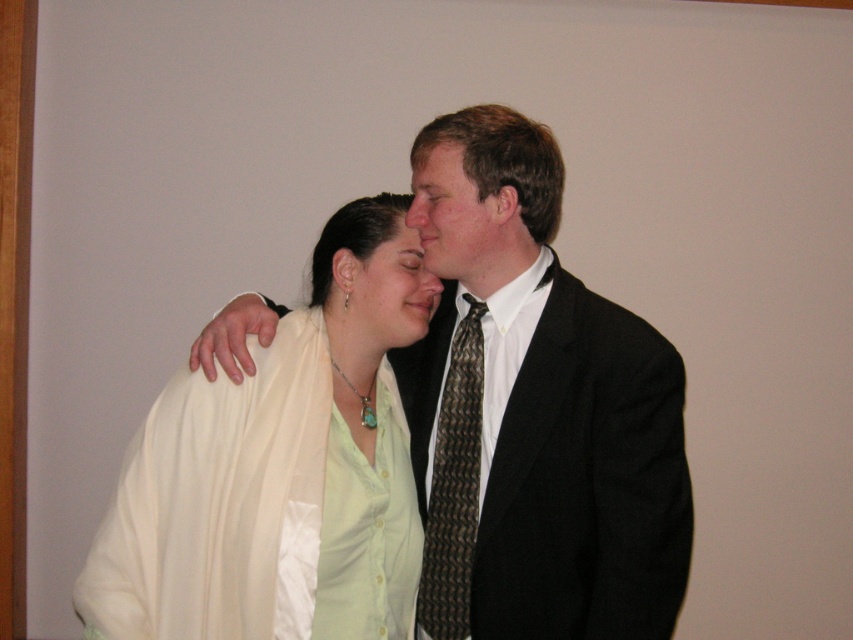
You are a photographer setting up for a portrait. You have a camera with a focal length of 50mm and want to capture both the light beige fabric at center and the matte black hair at center in sharp focus. The depth of field at this setting allows for objects within 40cm of each other to be in focus. Can both objects be in focus simultaneously?

The distance between the light beige fabric at center and matte black hair at center is 44.24 centimeters. Since the depth of field allows for objects within 40cm to be in focus, the distance exceeds the 40cm limit. Therefore, both objects cannot be in focus simultaneously.

You are a photographer setting up a shoot in this scene. You need to place a small microphone on the person wearing the matte black suit at center without it being visible in the photo. Where should you place the microphone relative to the brown woven tie at right?

The microphone should be placed above the brown woven tie at right since the matte black suit at center is positioned over it, which means the tie is underneath and placing the microphone on the suit above the tie would hide it from view.

You are a photographer adjusting the lighting for a portrait of the two individuals in the scene. You need to ensure that both the brown woven tie at right and the matte black suit at center are evenly lit. Given their distance apart, what is the minimum distance your lighting equipment must cover to illuminate both objects simultaneously?

The brown woven tie at right and matte black suit at center are 21.81 centimeters apart from each other. To ensure both are evenly lit, the lighting equipment must cover at least 21.81 centimeters.